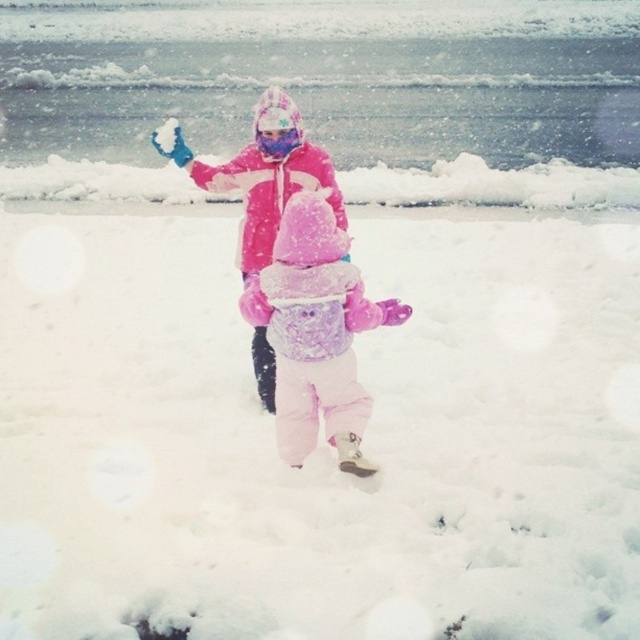
Question: Considering the real-world distances, which object is farthest from the fluffy pink snowsuit at center?

Choices:
 (A) pink fleece jacket at center
 (B) matte pink goggles at center

Answer: (B)

Question: Can you confirm if fluffy pink snowsuit at center is wider than matte pink goggles at center?

Choices:
 (A) yes
 (B) no

Answer: (A)

Question: Which object is closer to the camera taking this photo?

Choices:
 (A) pink fleece jacket at center
 (B) fluffy pink snowsuit at center
 (C) matte pink goggles at center

Answer: (B)

Question: Among these points, which one is nearest to the camera?

Choices:
 (A) (288, 288)
 (B) (248, 184)

Answer: (A)

Question: Does pink fleece jacket at center appear on the left side of matte pink goggles at center?

Choices:
 (A) yes
 (B) no

Answer: (A)

Question: Is pink fleece jacket at center further to camera compared to matte pink goggles at center?

Choices:
 (A) yes
 (B) no

Answer: (B)